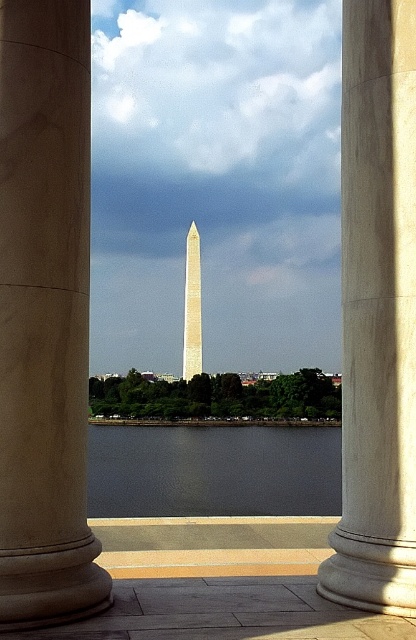
Is point (388, 177) less distant than point (165, 472)?

Yes, it is.

Measure the distance between beige stone column at center and camera.

They are 5.70 meters apart.

The width and height of the screenshot is (416, 640). I want to click on beige stone column at center, so click(376, 312).

Looking at this image, does beige marble column at center have a lesser height compared to white polished stone tower at center?

Yes, beige marble column at center is shorter than white polished stone tower at center.

Measure the distance between beige marble column at center and white polished stone tower at center.

beige marble column at center and white polished stone tower at center are 147.89 meters apart from each other.

Which is in front, point (32, 179) or point (195, 317)?

Point (32, 179) is in front.

Where is `beige marble column at center`? The width and height of the screenshot is (416, 640). beige marble column at center is located at coordinates (44, 316).

Does beige marble column at center have a larger size compared to dark gray water at center?

No, beige marble column at center is not bigger than dark gray water at center.

Can you confirm if beige marble column at center is smaller than dark gray water at center?

Correct, beige marble column at center occupies less space than dark gray water at center.

The width and height of the screenshot is (416, 640). Find the location of `beige marble column at center`. beige marble column at center is located at coordinates (44, 316).